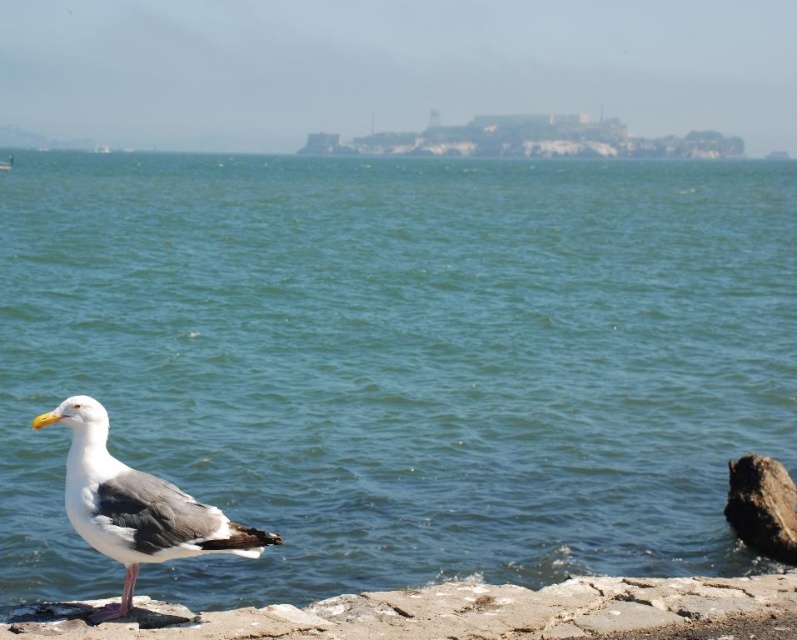
Question: Which point is farther to the camera?

Choices:
 (A) (132, 502)
 (B) (175, 292)

Answer: (B)

Question: Which point is closer to the camera?

Choices:
 (A) white feathered bird at lower left
 (B) blue water at center

Answer: (A)

Question: Does blue water at center appear on the left side of white feathered bird at lower left?

Choices:
 (A) no
 (B) yes

Answer: (A)

Question: Can you confirm if blue water at center is wider than white feathered bird at lower left?

Choices:
 (A) yes
 (B) no

Answer: (A)

Question: Can you confirm if blue water at center is smaller than white feathered bird at lower left?

Choices:
 (A) no
 (B) yes

Answer: (A)